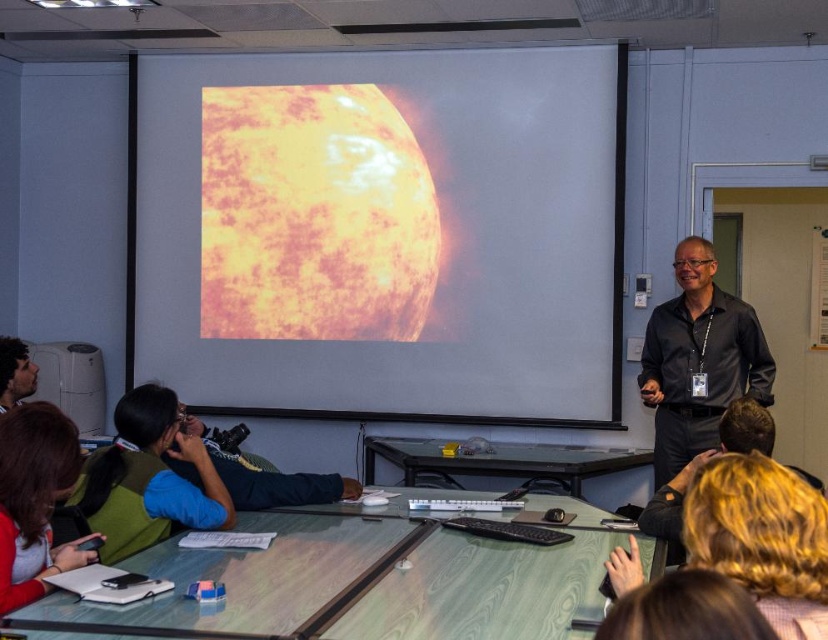
Which is more to the left, green wood table at lower center or black shirt at right?

green wood table at lower center is more to the left.

Between green wood table at lower center and black shirt at right, which one has less height?

With less height is green wood table at lower center.

Does point (357, 637) lie in front of point (687, 273)?

Yes, point (357, 637) is in front of point (687, 273).

Locate an element on the screen. green wood table at lower center is located at coordinates (360, 584).

Which is more to the left, matte yellow screen at upper center or green wood table at lower center?

From the viewer's perspective, matte yellow screen at upper center appears more on the left side.

Is point (445, 52) less distant than point (465, 609)?

No, (445, 52) is further to viewer.

Find the location of `matte yellow screen at upper center`. matte yellow screen at upper center is located at coordinates (383, 230).

Does matte yellow screen at upper center have a greater width compared to dark brown hair at upper left?

Yes.

Consider the image. Which is more to the right, matte yellow screen at upper center or dark brown hair at upper left?

matte yellow screen at upper center is more to the right.

Which is behind, point (372, 257) or point (25, 358)?

Positioned behind is point (372, 257).

I want to click on matte yellow screen at upper center, so click(383, 230).